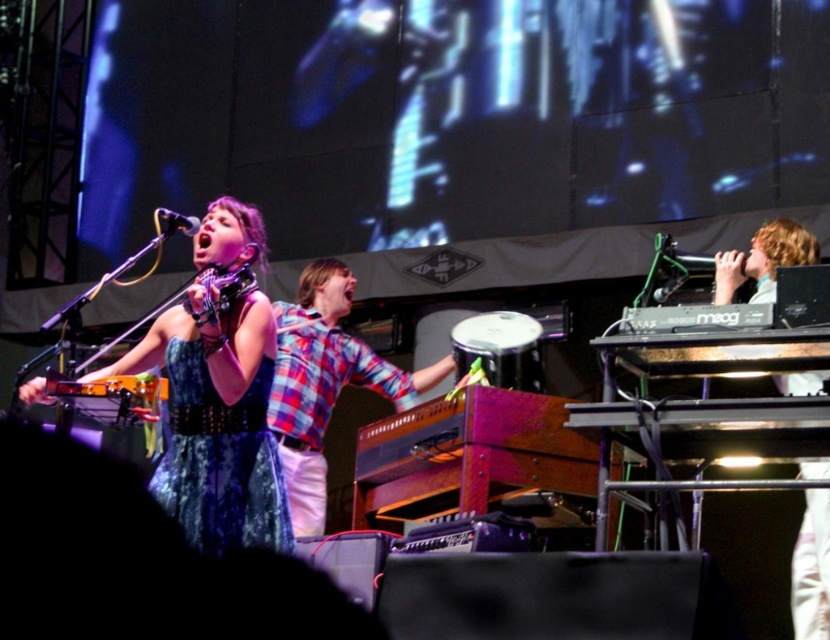
Does plaid fabric shirt at center appear on the left side of light brown wooden keyboard at right?

Correct, you'll find plaid fabric shirt at center to the left of light brown wooden keyboard at right.

Does plaid fabric shirt at center appear on the right side of light brown wooden keyboard at right?

No, plaid fabric shirt at center is not to the right of light brown wooden keyboard at right.

Does point (320, 326) lie behind point (824, 577)?

Yes, point (320, 326) is behind point (824, 577).

Find the location of a particular element. plaid fabric shirt at center is located at coordinates (325, 381).

Looking at this image, can you confirm if plaid fabric shirt at center is positioned above matte black microphone at upper left?

Incorrect, plaid fabric shirt at center is not positioned above matte black microphone at upper left.

Where is `plaid fabric shirt at center`? This screenshot has width=830, height=640. plaid fabric shirt at center is located at coordinates (325, 381).

Where is `plaid fabric shirt at center`? Image resolution: width=830 pixels, height=640 pixels. plaid fabric shirt at center is located at coordinates (325, 381).

Is shiny blue dress at left further to the viewer compared to light brown wooden keyboard at right?

No, shiny blue dress at left is in front of light brown wooden keyboard at right.

Consider the image. Does shiny blue dress at left appear under light brown wooden keyboard at right?

Indeed, shiny blue dress at left is positioned under light brown wooden keyboard at right.

Does point (277, 456) come farther from viewer compared to point (813, 618)?

No, it is not.

What are the coordinates of `shiny blue dress at left` in the screenshot? It's located at (220, 460).